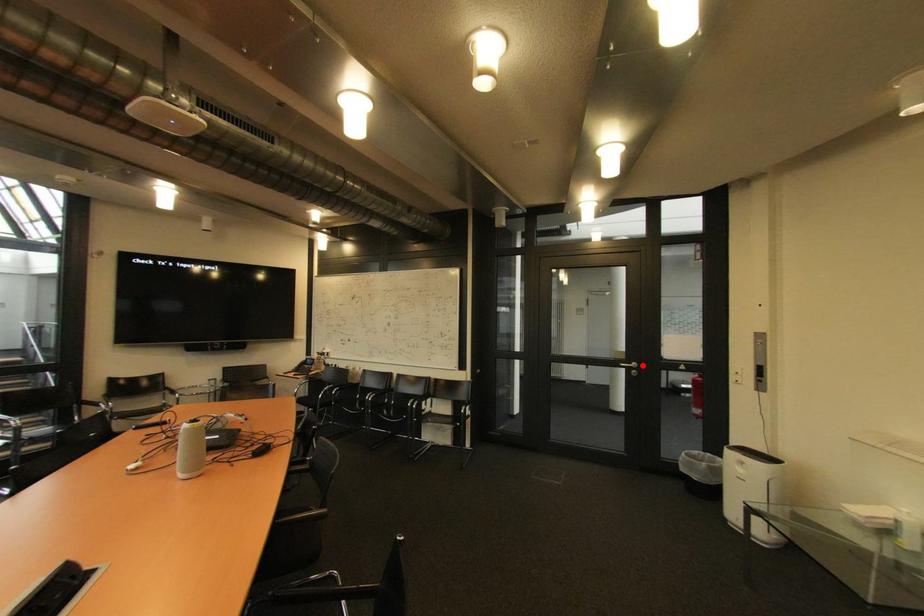
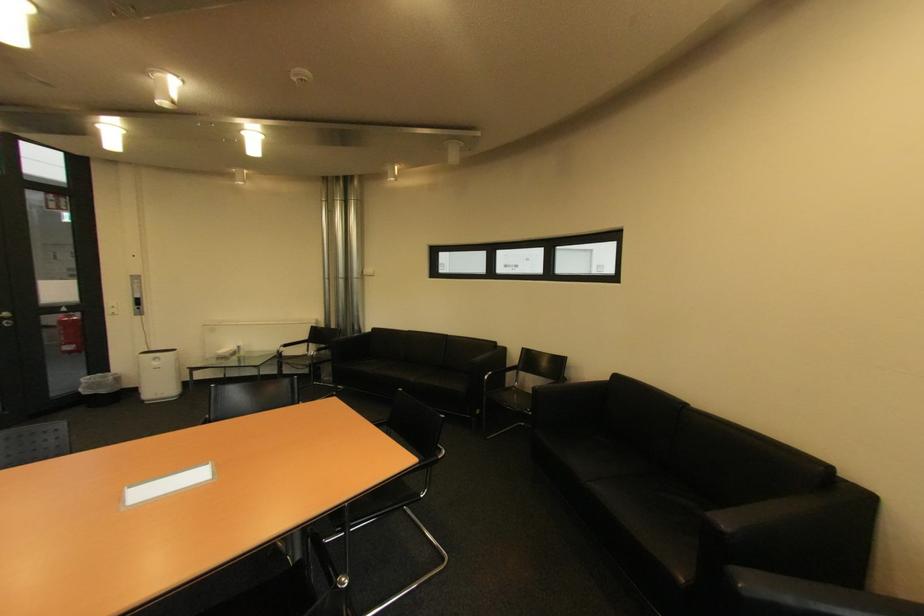
Find the pixel in the second image that matches the highlighted location in the first image.

(14, 315)